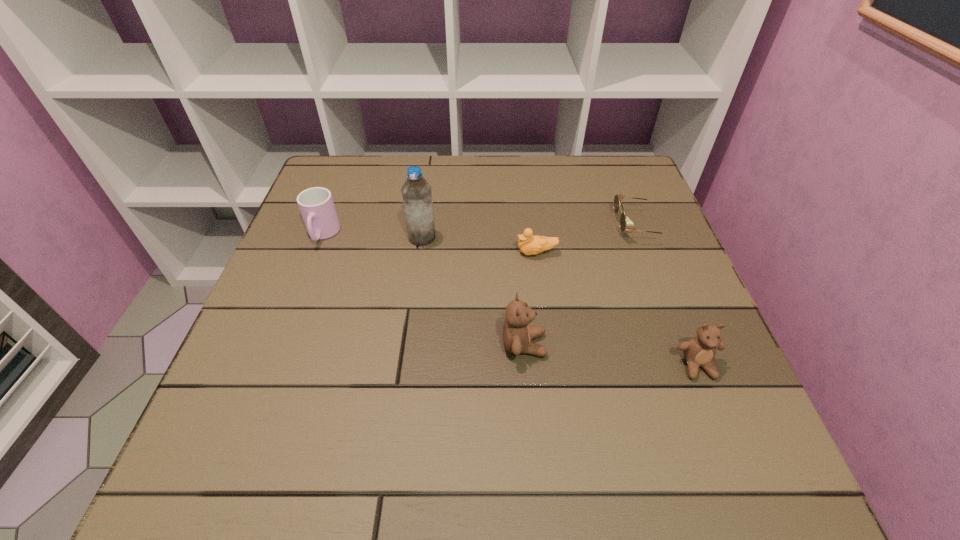
Where is `object that stands as the closest to the cup`? Image resolution: width=960 pixels, height=540 pixels. object that stands as the closest to the cup is located at coordinates (416, 192).

I want to click on object that stands as the third closest to the right teddy bear, so click(529, 245).